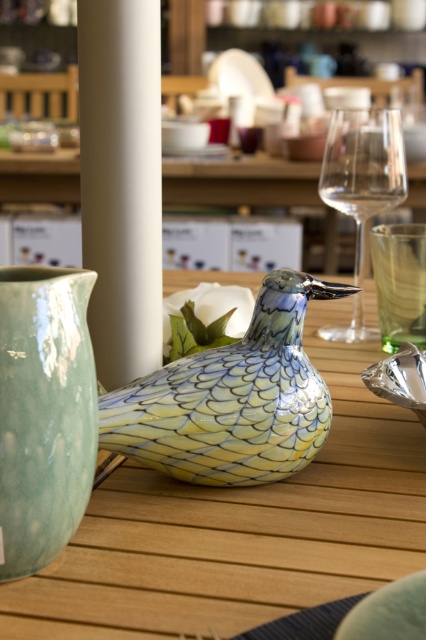
You are a customer at a cafe and want to place your phone on the closest object to you on the table. Which object should you choose between the matte green vase at left and the ceramic bird pitcher?

The matte green vase at left is 17.26 centimeters away from viewer, so you should place your phone on the matte green vase at left as it is closer.

You are a server arranging items on a table. You have a shiny ceramic bird at center and a white smooth pillar at center. Which item takes up more horizontal space on the table?

The shiny ceramic bird at center has a greater width than the white smooth pillar at center, so it takes up more horizontal space on the table.

You are a customer at a cafe and want to pour water from the shiny ceramic bird at center into your cup. Where exactly should you place your cup to catch the water?

The shiny ceramic bird at center is positioned at point (232, 397), so you should place your cup directly below this coordinate to catch the water.